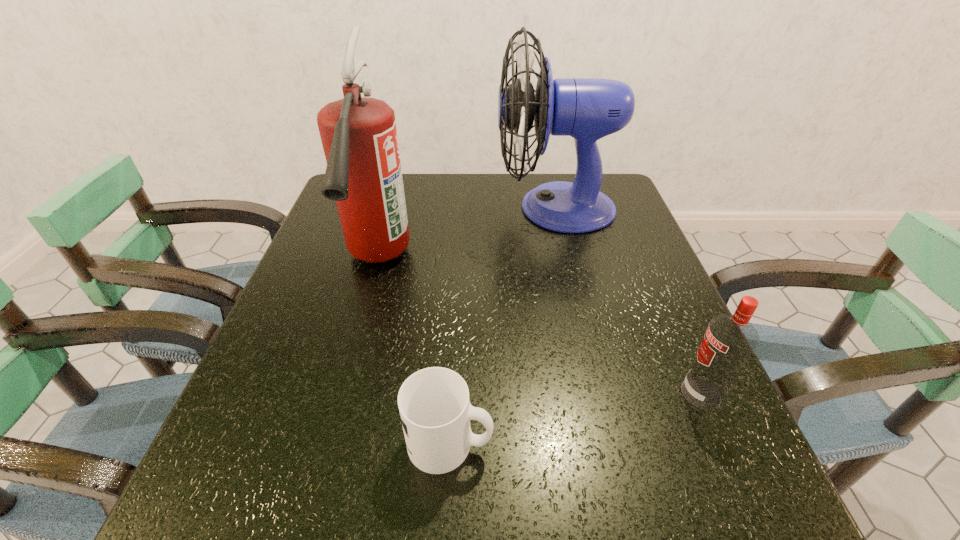
Find the location of `fire extinguisher`. fire extinguisher is located at coordinates (363, 175).

Where is `fan`? The height and width of the screenshot is (540, 960). fan is located at coordinates (587, 109).

At what (x,y) coordinates should I click in order to perform the action: click on the third farthest object. Please return your answer as a coordinate pair (x, y). The image size is (960, 540). Looking at the image, I should click on click(729, 341).

You are a GUI agent. You are given a task and a screenshot of the screen. Output one action in this format:
    pyautogui.click(x=<x>, y=<y>)
    Task: Click on the third tallest object
    
    Given the screenshot: What is the action you would take?
    pyautogui.click(x=729, y=341)

At what (x,y) coordinates should I click in order to perform the action: click on mug. Please return your answer as a coordinate pair (x, y). Image resolution: width=960 pixels, height=540 pixels. Looking at the image, I should click on (435, 410).

The height and width of the screenshot is (540, 960). In order to click on the second object from left to right in this screenshot , I will do `click(435, 410)`.

Where is `blank area located at the nozzle of the leftmost object`? The width and height of the screenshot is (960, 540). blank area located at the nozzle of the leftmost object is located at coordinates point(325,446).

Identify the location of free space located 0.090m in front of the fan where the airflow is directed. (463, 208).

You are a GUI agent. You are given a task and a screenshot of the screen. Output one action in this format:
    pyautogui.click(x=<x>, y=<y>)
    Task: Click on the blank space located in front of the fan where the airflow is directed
    This screenshot has height=540, width=960.
    Given the screenshot: What is the action you would take?
    click(366, 208)

Identify the location of free space located 0.100m in front of the fan where the airflow is directed. The image size is (960, 540). [x=460, y=208].